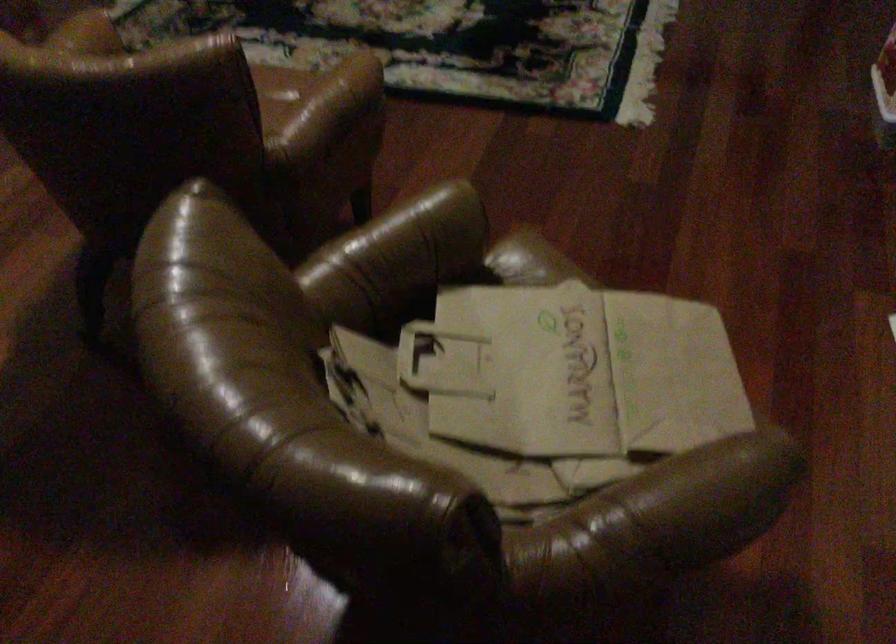
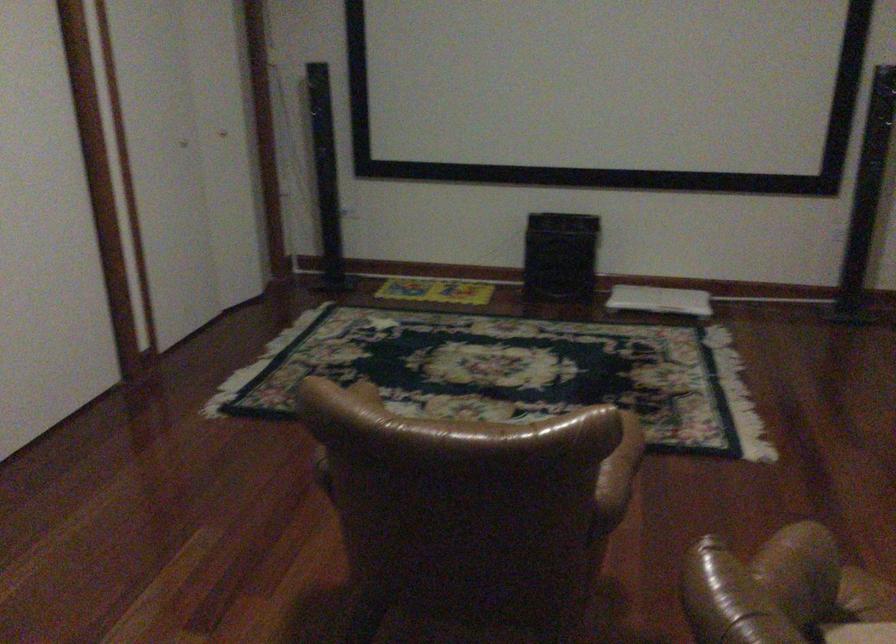
In the second image, find the point that corresponds to [323,111] in the first image.

(622, 460)